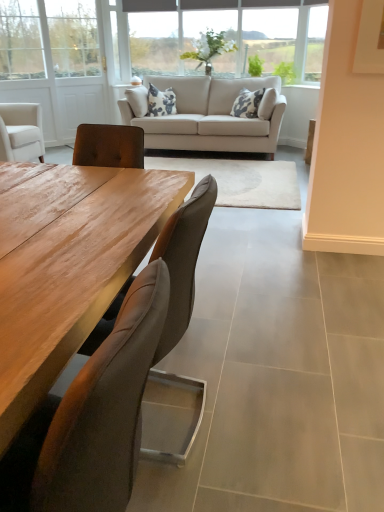
What do you see at coordinates (210, 116) in the screenshot?
I see `beige fabric couch at center` at bounding box center [210, 116].

Where is `clear glass vase at upper center, which appears as the first window when viewed from the right`? Image resolution: width=384 pixels, height=512 pixels. clear glass vase at upper center, which appears as the first window when viewed from the right is located at coordinates coord(210,40).

This screenshot has height=512, width=384. What do you see at coordinates (58, 63) in the screenshot?
I see `white wood screen door at upper left` at bounding box center [58, 63].

The image size is (384, 512). What do you see at coordinates (218, 31) in the screenshot? I see `clear glass window at upper center, marked as the first window in a left-to-right arrangement` at bounding box center [218, 31].

The image size is (384, 512). I want to click on clear glass window at upper center, which appears as the 2th window when viewed from the right, so pos(218,31).

What are the coordinates of `brown leather chair at center, arranged as the second chair when viewed from the front` in the screenshot? It's located at (183, 260).

Identify the location of beige fabric couch at center. The height and width of the screenshot is (512, 384). (210, 116).

Considering the relative positions of white wood screen door at upper left and beige fabric couch at center in the image provided, is white wood screen door at upper left to the left or to the right of beige fabric couch at center?

Based on their positions, white wood screen door at upper left is located to the left of beige fabric couch at center.

Where is `screen door on the left side of beige fabric couch at center`? The width and height of the screenshot is (384, 512). screen door on the left side of beige fabric couch at center is located at coordinates (58, 63).

Consider the image. What's the angular difference between white wood screen door at upper left and beige fabric couch at center's facing directions?

Result: They differ by 46.2 degrees in their facing directions.

Based on the photo, which is correct: white wood screen door at upper left is inside beige fabric couch at center, or outside of it?

white wood screen door at upper left cannot be found inside beige fabric couch at center.

From a real-world perspective, who is located higher, brown leather chair at center, arranged as the second chair when viewed from the front, or clear glass window at upper center, marked as the first window in a left-to-right arrangement?

clear glass window at upper center, marked as the first window in a left-to-right arrangement, from a real-world perspective.

Based on the photo, is brown leather chair at center, arranged as the second chair when viewed from the front, aimed at clear glass window at upper center, marked as the first window in a left-to-right arrangement?

No.

Relative to clear glass window at upper center, which appears as the 2th window when viewed from the right, is brown leather chair at center, arranged as the second chair when viewed from the front, in front or behind?

brown leather chair at center, arranged as the second chair when viewed from the front, is positioned closer to the viewer than clear glass window at upper center, which appears as the 2th window when viewed from the right.

From the image's perspective, would you say brown leather chair at center, arranged as the second chair when viewed from the front, is positioned over leather cushioned chair at center, the 1th chair positioned from the front?

Indeed, from the image's perspective, brown leather chair at center, arranged as the second chair when viewed from the front, is shown above leather cushioned chair at center, the 1th chair positioned from the front.

Considering the relative positions of brown leather chair at center, the first chair positioned from the back, and leather cushioned chair at center, the 1th chair positioned from the front, in the image provided, is brown leather chair at center, the first chair positioned from the back, in front of leather cushioned chair at center, the 1th chair positioned from the front,?

No, brown leather chair at center, the first chair positioned from the back, is behind leather cushioned chair at center, the 1th chair positioned from the front.

Are brown leather chair at center, arranged as the second chair when viewed from the front, and leather cushioned chair at center, the 2th chair when ordered from back to front, beside each other?

There is a gap between brown leather chair at center, arranged as the second chair when viewed from the front, and leather cushioned chair at center, the 2th chair when ordered from back to front.

Is beige fabric couch at center further to the viewer compared to clear glass vase at upper center, which appears as the first window when viewed from the right?

No, it is not.

Is beige fabric couch at center with clear glass vase at upper center, which appears as the first window when viewed from the right?

No, beige fabric couch at center is not making contact with clear glass vase at upper center, which appears as the first window when viewed from the right.

Can we say beige fabric couch at center lies outside clear glass vase at upper center, which appears as the first window when viewed from the right?

Yes, beige fabric couch at center is not within clear glass vase at upper center, which appears as the first window when viewed from the right.

Locate an element on the screen. The image size is (384, 512). the 2nd chair counting from the left of the beige fabric couch at center is located at coordinates (92, 418).

Is beige fabric couch at center further to camera compared to leather cushioned chair at center, the 1th chair positioned from the front?

Yes, beige fabric couch at center is further from the camera.

Does point (220, 99) come farther from viewer compared to point (158, 260)?

Yes, point (220, 99) is farther from viewer.

Considering the relative sizes of beige fabric couch at center and leather cushioned chair at center, the 1th chair positioned from the front, in the image provided, is beige fabric couch at center wider than leather cushioned chair at center, the 1th chair positioned from the front,?

Yes, beige fabric couch at center is wider than leather cushioned chair at center, the 1th chair positioned from the front.

Is there a large distance between leather cushioned chair at center, the 1th chair positioned from the front, and beige fabric couch at center?

Yes, leather cushioned chair at center, the 1th chair positioned from the front, and beige fabric couch at center are located far from each other.

From a real-world perspective, count 1st chairs downward from the beige fabric couch at center and point to it. Please provide its 2D coordinates.

[(92, 418)]

Is leather cushioned chair at center, the 1th chair positioned from the front, smaller than beige fabric couch at center?

Yes.

In the scene shown: Does white wood screen door at upper left touch brown leather chair at center, the first chair positioned from the back?

No, white wood screen door at upper left is not beside brown leather chair at center, the first chair positioned from the back.

From a real-world perspective, which is physically below, white wood screen door at upper left or brown leather chair at center, the first chair positioned from the back?

brown leather chair at center, the first chair positioned from the back, from a real-world perspective.

Considering the positions of objects white wood screen door at upper left and brown leather chair at center, arranged as the second chair when viewed from the front, in the image provided, who is behind, white wood screen door at upper left or brown leather chair at center, arranged as the second chair when viewed from the front,?

white wood screen door at upper left.

Locate an element on the screen. screen door behind the beige fabric couch at center is located at coordinates (58, 63).

From a real-world perspective, starting from the clear glass window at upper center, marked as the first window in a left-to-right arrangement, which chair is the 2nd one below it? Please provide its 2D coordinates.

[(183, 260)]

Estimate the real-world distances between objects in this image. Which object is closer to beige fabric couch at center, clear glass window at upper center, which appears as the 2th window when viewed from the right, or brown leather chair at center, arranged as the second chair when viewed from the front?

The object closer to beige fabric couch at center is clear glass window at upper center, which appears as the 2th window when viewed from the right.

Which object lies nearer to the anchor point clear glass window at upper center, marked as the first window in a left-to-right arrangement, leather cushioned chair at center, the 2th chair when ordered from back to front, or white wood screen door at upper left?

white wood screen door at upper left.

Estimate the real-world distances between objects in this image. Which object is further from leather cushioned chair at center, the 2th chair when ordered from back to front, brown leather chair at center, arranged as the second chair when viewed from the front, or beige fabric couch at center?

beige fabric couch at center.

Which object lies nearer to the anchor point brown leather chair at center, arranged as the second chair when viewed from the front, white wood screen door at upper left or beige fabric couch at center?

Based on the image, beige fabric couch at center appears to be nearer to brown leather chair at center, arranged as the second chair when viewed from the front.

When comparing their distances from leather cushioned chair at center, the 1th chair positioned from the front, does beige fabric couch at center or clear glass window at upper center, marked as the first window in a left-to-right arrangement, seem further?

clear glass window at upper center, marked as the first window in a left-to-right arrangement, lies further to leather cushioned chair at center, the 1th chair positioned from the front, than the other object.

When comparing their distances from clear glass vase at upper center, which appears as the first window when viewed from the right, does clear glass window at upper center, which appears as the 2th window when viewed from the right, or white wood screen door at upper left seem further?

The object further to clear glass vase at upper center, which appears as the first window when viewed from the right, is white wood screen door at upper left.

Which object lies nearer to the anchor point beige fabric couch at center, brown leather chair at center, the first chair positioned from the back, or leather cushioned chair at center, the 1th chair positioned from the front?

Among the two, brown leather chair at center, the first chair positioned from the back, is located nearer to beige fabric couch at center.

Considering their positions, is brown leather chair at center, arranged as the second chair when viewed from the front, positioned further to white wood screen door at upper left than clear glass window at upper center, which appears as the 2th window when viewed from the right?

Based on the image, brown leather chair at center, arranged as the second chair when viewed from the front, appears to be further to white wood screen door at upper left.

Image resolution: width=384 pixels, height=512 pixels. In order to click on studio couch located between leather cushioned chair at center, the 2th chair when ordered from back to front, and white wood screen door at upper left in the depth direction in this screenshot , I will do `click(210, 116)`.

This screenshot has width=384, height=512. I want to click on window located between brown leather chair at center, arranged as the second chair when viewed from the front, and clear glass window at upper center, which appears as the 2th window when viewed from the right, in the depth direction, so click(210, 40).

This screenshot has height=512, width=384. I want to click on studio couch situated between white wood screen door at upper left and clear glass vase at upper center, the 2th window when ordered from left to right, from left to right, so click(x=210, y=116).

At what (x,y) coordinates should I click in order to perform the action: click on chair positioned between leather cushioned chair at center, the 2th chair when ordered from back to front, and white wood screen door at upper left from near to far. Please return your answer as a coordinate pair (x, y). Image resolution: width=384 pixels, height=512 pixels. Looking at the image, I should click on pos(183,260).